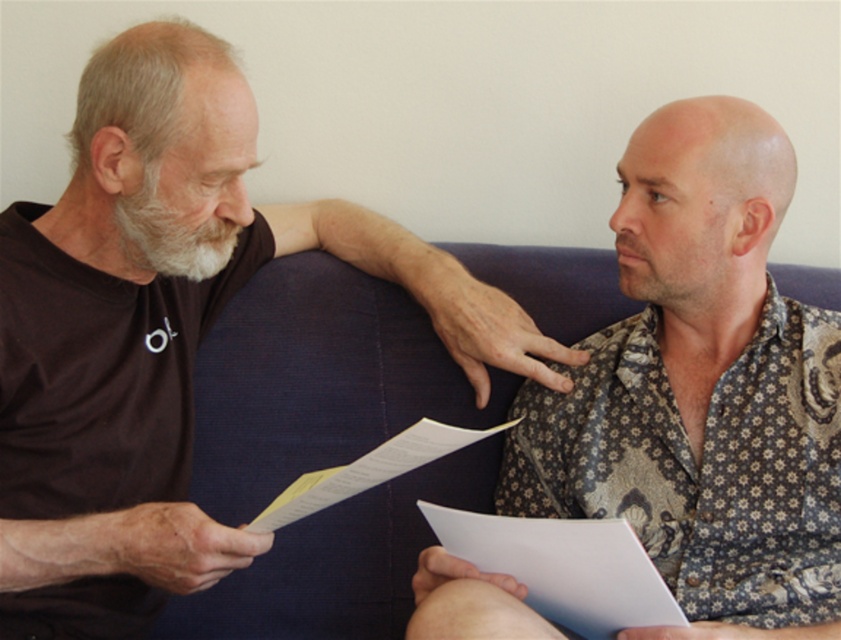
Question: Which point is farther to the camera?

Choices:
 (A) floral-patterned shirt at center
 (B) white soft beard at left

Answer: (B)

Question: Which point is farther to the camera?

Choices:
 (A) (152, 236)
 (B) (361, 468)
 (C) (696, 561)

Answer: (C)

Question: Which object appears farthest from the camera in this image?

Choices:
 (A) floral-patterned shirt at center
 (B) white paper at center
 (C) brown cotton shirt at left

Answer: (B)

Question: Is floral-patterned shirt at center to the right of white paper at center from the viewer's perspective?

Choices:
 (A) yes
 (B) no

Answer: (A)

Question: Is brown cotton shirt at left above white paper at center?

Choices:
 (A) yes
 (B) no

Answer: (A)

Question: Is floral-patterned shirt at center behind white soft beard at left?

Choices:
 (A) yes
 (B) no

Answer: (B)